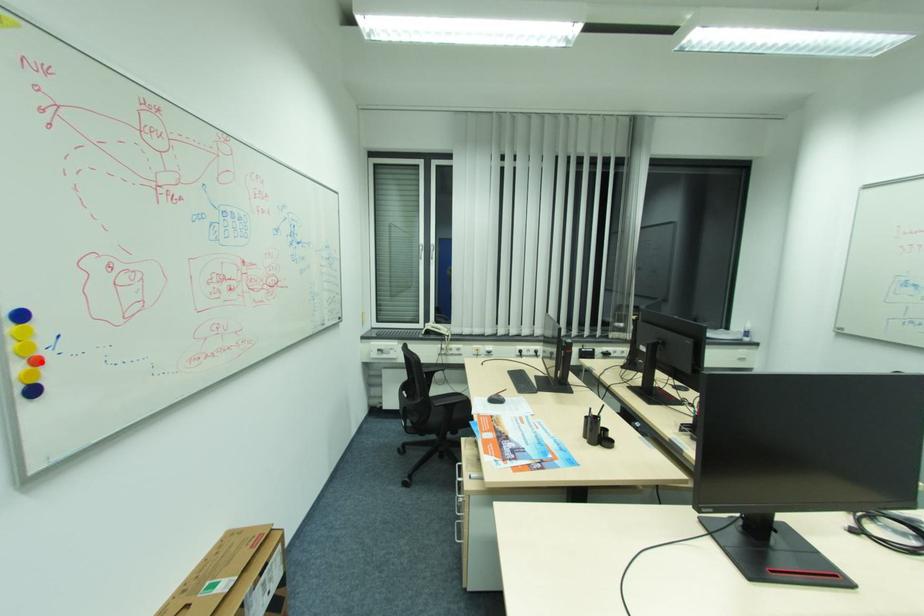
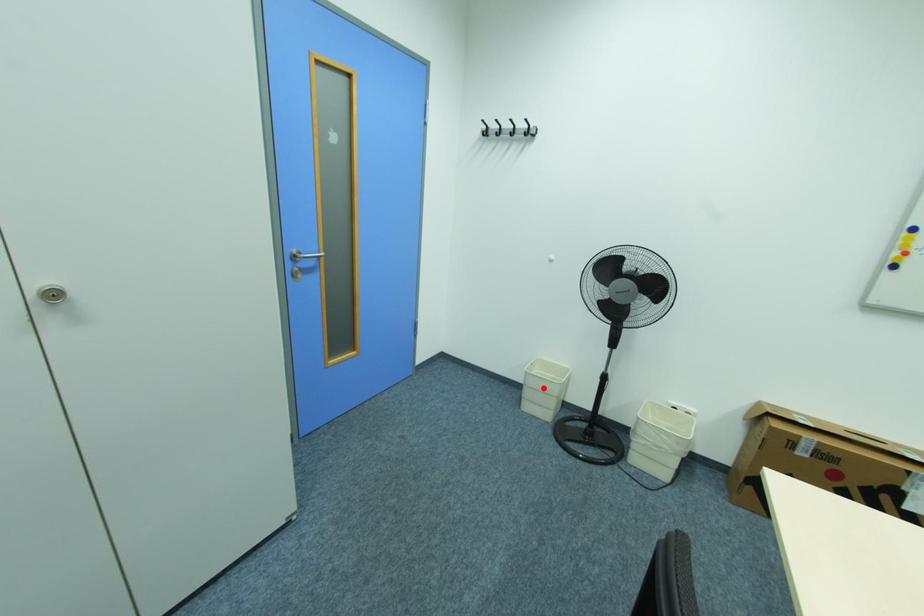
I am providing you with two images of the same scene from different viewpoints. A red point is marked on the first image and another point is marked on the second image. Is the red point in image1 aligned with the point shown in image2?

No